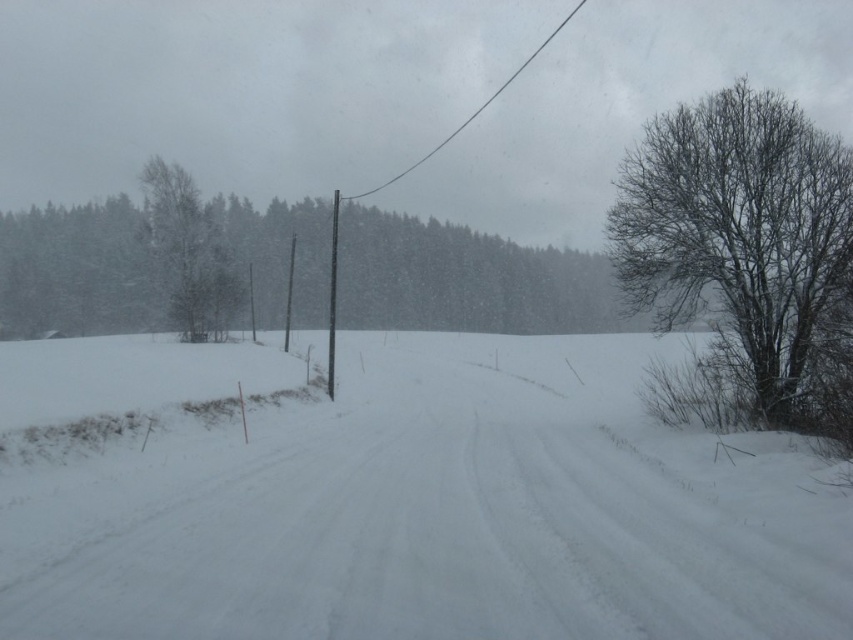
Question: Which object appears closest to the camera in this image?

Choices:
 (A) white powdery snow at center
 (B) green textured tree at left
 (C) smooth gray pole at center

Answer: (A)

Question: Is green textured tree at left smaller than smooth gray pole at center?

Choices:
 (A) no
 (B) yes

Answer: (B)

Question: Can you confirm if white powdery snow at center is wider than black wire at upper center?

Choices:
 (A) yes
 (B) no

Answer: (B)

Question: Does bare branches at right appear under green textured tree at left?

Choices:
 (A) no
 (B) yes

Answer: (A)

Question: Which object is positioned farthest from the smooth gray pole at center?

Choices:
 (A) bare branches at right
 (B) green textured tree at left
 (C) white powdery snow at center
 (D) black wire at upper center

Answer: (D)

Question: Which object is farther from the camera taking this photo?

Choices:
 (A) bare branches at right
 (B) black wire at upper center
 (C) smooth gray pole at center

Answer: (B)